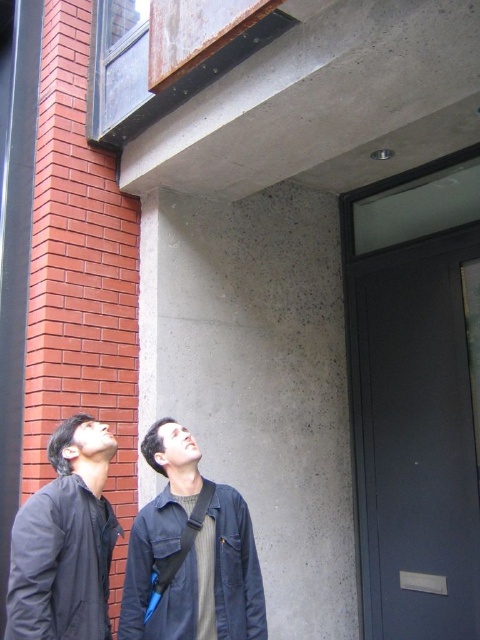
What do you see at coordinates (64, 541) in the screenshot?
I see `dark blue jacket at lower left` at bounding box center [64, 541].

Does dark blue jacket at lower left have a greater width compared to dark blue cotton jacket at lower center?

Incorrect, dark blue jacket at lower left's width does not surpass dark blue cotton jacket at lower center's.

Is point (50, 611) positioned before point (181, 531)?

Yes, it is.

Locate an element on the screen. dark blue jacket at lower left is located at coordinates (64, 541).